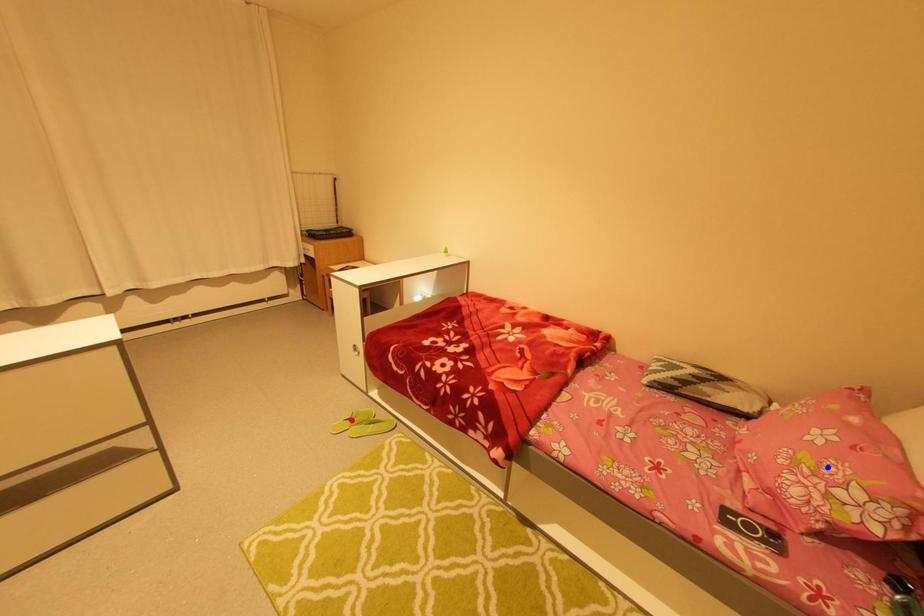
Question: Which of the two points in the image is closer to the camera?

Choices:
 (A) Blue point is closer.
 (B) Red point is closer.

Answer: (A)